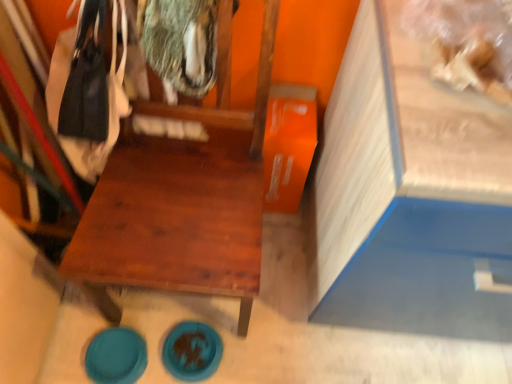
Question: Is teal glossy plate at lower left, which ranks as the 1th plate in left-to-right order, in contact with blue matte plate at lower center, which is counted as the 2th plate, starting from the left?

Choices:
 (A) no
 (B) yes

Answer: (A)

Question: Does teal glossy plate at lower left, marked as the second plate in a right-to-left arrangement, have a greater width compared to blue matte plate at lower center, which is counted as the 2th plate, starting from the left?

Choices:
 (A) yes
 (B) no

Answer: (B)

Question: Does teal glossy plate at lower left, marked as the second plate in a right-to-left arrangement, have a lesser height compared to blue matte plate at lower center, which is counted as the 2th plate, starting from the left?

Choices:
 (A) yes
 (B) no

Answer: (B)

Question: From the image's perspective, would you say teal glossy plate at lower left, which ranks as the 1th plate in left-to-right order, is positioned over blue matte plate at lower center, which is counted as the 1th plate, starting from the right?

Choices:
 (A) yes
 (B) no

Answer: (B)

Question: From a real-world perspective, is teal glossy plate at lower left, which ranks as the 1th plate in left-to-right order, under blue matte plate at lower center, which is counted as the 1th plate, starting from the right?

Choices:
 (A) no
 (B) yes

Answer: (B)

Question: From the image's perspective, is wooden chair at center above or below blue matte plate at lower center, which is counted as the 1th plate, starting from the right?

Choices:
 (A) above
 (B) below

Answer: (A)

Question: Does point (122, 195) appear closer or farther from the camera than point (201, 362)?

Choices:
 (A) farther
 (B) closer

Answer: (B)

Question: Looking at the image, does wooden chair at center seem bigger or smaller compared to blue matte plate at lower center, which is counted as the 1th plate, starting from the right?

Choices:
 (A) small
 (B) big

Answer: (B)

Question: Which is correct: wooden chair at center is inside blue matte plate at lower center, which is counted as the 1th plate, starting from the right, or outside of it?

Choices:
 (A) inside
 (B) outside

Answer: (B)

Question: From the image's perspective, is blue matte plate at lower center, which is counted as the 1th plate, starting from the right, above or below teal glossy plate at lower left, marked as the second plate in a right-to-left arrangement?

Choices:
 (A) above
 (B) below

Answer: (A)

Question: Considering their positions, is blue matte plate at lower center, which is counted as the 2th plate, starting from the left, located in front of or behind teal glossy plate at lower left, which ranks as the 1th plate in left-to-right order?

Choices:
 (A) front
 (B) behind

Answer: (B)

Question: Considering the relative positions of blue matte plate at lower center, which is counted as the 2th plate, starting from the left, and teal glossy plate at lower left, marked as the second plate in a right-to-left arrangement, in the image provided, is blue matte plate at lower center, which is counted as the 2th plate, starting from the left, to the left or to the right of teal glossy plate at lower left, marked as the second plate in a right-to-left arrangement,?

Choices:
 (A) left
 (B) right

Answer: (B)

Question: Looking at the image, does blue matte plate at lower center, which is counted as the 1th plate, starting from the right, seem bigger or smaller compared to teal glossy plate at lower left, which ranks as the 1th plate in left-to-right order?

Choices:
 (A) small
 (B) big

Answer: (B)

Question: From a real-world perspective, relative to teal glossy plate at lower left, which ranks as the 1th plate in left-to-right order, is wooden chair at center vertically above or below?

Choices:
 (A) below
 (B) above

Answer: (B)

Question: From the image's perspective, is wooden chair at center located above or below teal glossy plate at lower left, marked as the second plate in a right-to-left arrangement?

Choices:
 (A) below
 (B) above

Answer: (B)